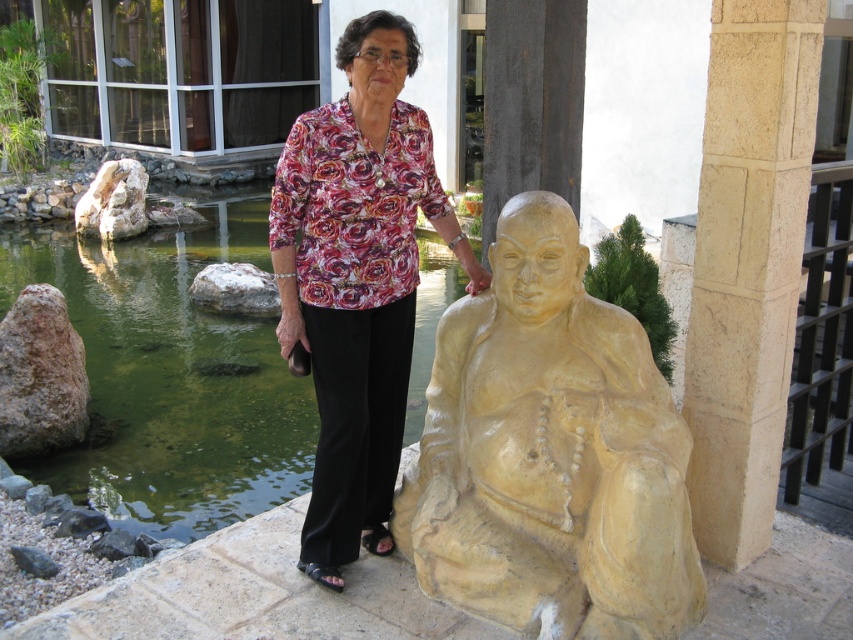
Does yellow stone statue at center have a greater height compared to green water at pond left?

Yes, yellow stone statue at center is taller than green water at pond left.

Can you confirm if yellow stone statue at center is positioned below green water at pond left?

Yes.

Locate an element on the screen. yellow stone statue at center is located at coordinates (550, 452).

Who is lower down, green water at pond left or floral fabric blouse at center?

floral fabric blouse at center

Is green water at pond left bigger than floral fabric blouse at center?

Incorrect, green water at pond left is not larger than floral fabric blouse at center.

Does point (45, 260) come behind point (386, 282)?

Yes.

The image size is (853, 640). Identify the location of green water at pond left. (170, 374).

The image size is (853, 640). Describe the element at coordinates (550, 452) in the screenshot. I see `yellow stone statue at center` at that location.

Does yellow stone statue at center have a greater width compared to beige stone pillar at right?

Yes, yellow stone statue at center is wider than beige stone pillar at right.

This screenshot has width=853, height=640. What do you see at coordinates (550, 452) in the screenshot?
I see `yellow stone statue at center` at bounding box center [550, 452].

This screenshot has height=640, width=853. Identify the location of yellow stone statue at center. (x=550, y=452).